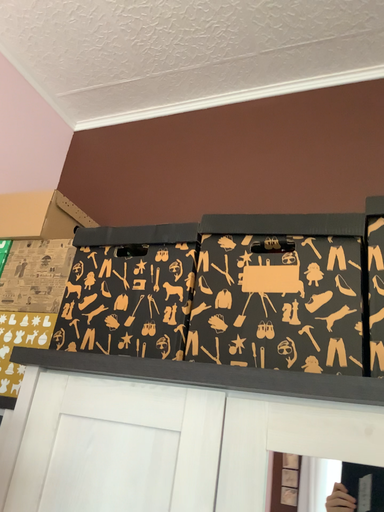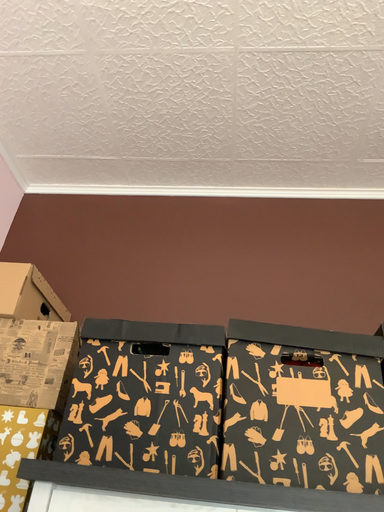
Question: Which way did the camera rotate in the video?

Choices:
 (A) rotated downward
 (B) rotated upward

Answer: (B)